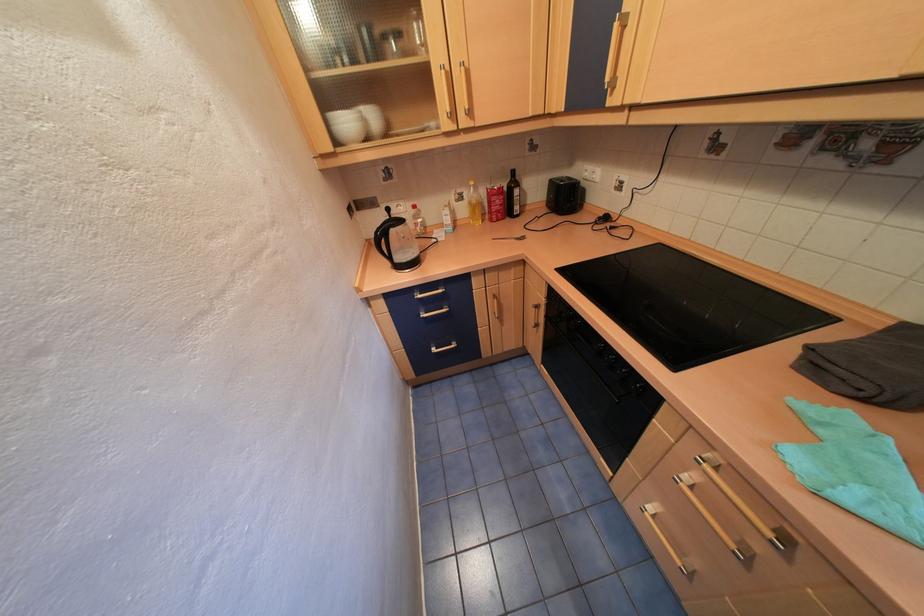
Where is `black kettle handle`? This screenshot has height=616, width=924. black kettle handle is located at coordinates (381, 240).